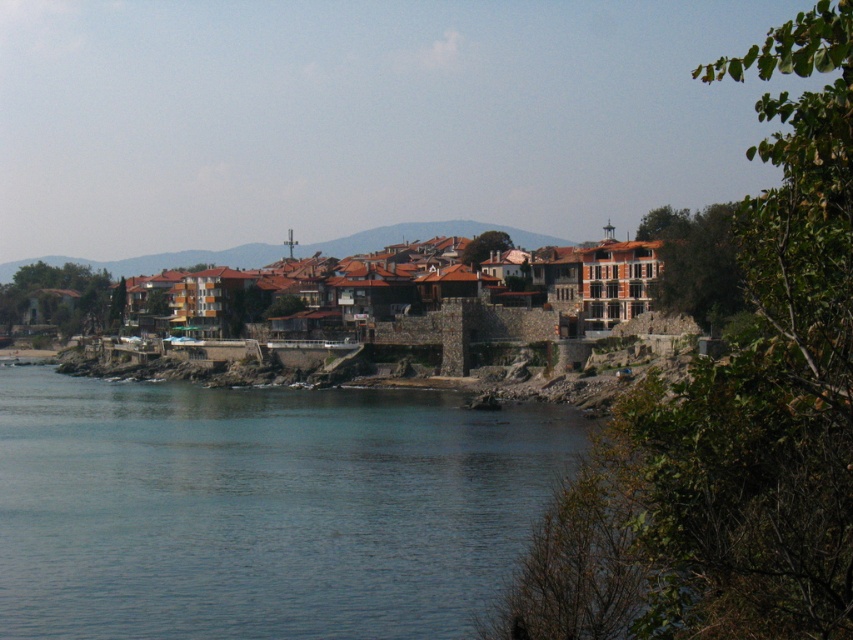
Does brown stone buildings at center lie behind brown tiled roofs at center?

No, it is not.

Is point (227, 250) farther from viewer compared to point (357, 243)?

Yes, it is.

Is point (553, 237) positioned after point (218, 262)?

No, (553, 237) is in front of (218, 262).

Identify the location of brown stone buildings at center. (190, 259).

Does blue water at lower left appear under brown tiled roofs at center?

Correct, blue water at lower left is located below brown tiled roofs at center.

Is point (502, 490) farther from viewer compared to point (257, 260)?

No, (502, 490) is closer to viewer.

Is point (170, 570) positioned after point (373, 244)?

No, (170, 570) is in front of (373, 244).

You are a GUI agent. You are given a task and a screenshot of the screen. Output one action in this format:
    pyautogui.click(x=<x>, y=<y>)
    Task: Click on the blue water at lower left
    
    Given the screenshot: What is the action you would take?
    pyautogui.click(x=262, y=508)

Can you confirm if blue water at lower left is smaller than brown stone buildings at center?

Yes, blue water at lower left is smaller than brown stone buildings at center.

Which is in front, point (248, 556) or point (421, 221)?

Point (248, 556) is in front.

Between point (196, 634) and point (138, 273), which one is positioned behind?

Point (138, 273)

Where is `blue water at lower left`? This screenshot has height=640, width=853. blue water at lower left is located at coordinates (262, 508).